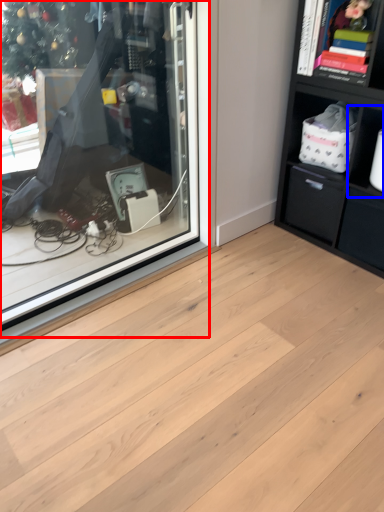
Question: Which object appears closest to the camera in this image, shop window (highlighted by a red box) or cabinet (highlighted by a blue box)?

Choices:
 (A) shop window
 (B) cabinet

Answer: (A)